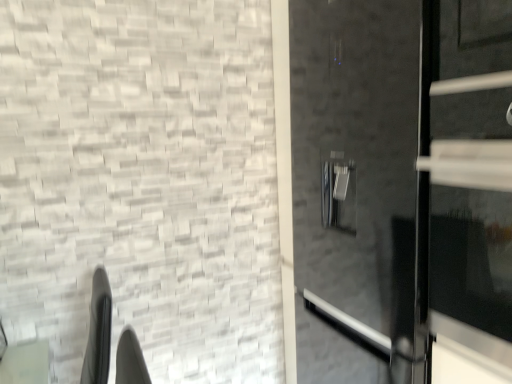
Identify the location of glossy black door at right, which is counted as the second door, starting from the front. (403, 181).

What is the approximate height of glossy black door at right, which is counted as the second door, starting from the front?

It is 5.79 feet.

What do you see at coordinates (403, 181) in the screenshot? I see `glossy black door at right, which is counted as the second door, starting from the front` at bounding box center [403, 181].

Looking at this image, what is the approximate width of glossy black door at right, which is counted as the second door, starting from the front?

glossy black door at right, which is counted as the second door, starting from the front, is 26.76 inches wide.

This screenshot has height=384, width=512. What are the coordinates of `black glass door at right, which is the 1th door from front to back` in the screenshot? It's located at (467, 179).

Describe the element at coordinates (467, 179) in the screenshot. I see `black glass door at right, which is the 1th door from front to back` at that location.

This screenshot has width=512, height=384. Find the location of `glossy black door at right, which is the 1th door from back to front`. glossy black door at right, which is the 1th door from back to front is located at coordinates (403, 181).

Which is more to the left, black glass door at right, which is the 1th door from front to back, or glossy black door at right, which is counted as the second door, starting from the front?

black glass door at right, which is the 1th door from front to back.

Is black glass door at right, which is the 1th door from front to back, further to the viewer compared to glossy black door at right, which is the 1th door from back to front?

No, black glass door at right, which is the 1th door from front to back, is closer to the camera.

Which is behind, point (510, 294) or point (455, 285)?

The point (455, 285) is more distant.

From the image's perspective, between black glass door at right, which is the 1th door from front to back, and glossy black door at right, which is the 1th door from back to front, who is located below?

glossy black door at right, which is the 1th door from back to front, appears lower in the image.

Consider the image. From a real-world perspective, is black glass door at right, which is the 1th door from front to back, positioned above or below glossy black door at right, which is the 1th door from back to front?

Clearly, from a real-world perspective, black glass door at right, which is the 1th door from front to back, is above glossy black door at right, which is the 1th door from back to front.

Does black glass door at right, the 2th door when ordered from back to front, have a greater width compared to glossy black door at right, which is counted as the second door, starting from the front?

No.

In terms of height, does black glass door at right, the 2th door when ordered from back to front, look taller or shorter compared to glossy black door at right, which is counted as the second door, starting from the front?

In the image, black glass door at right, the 2th door when ordered from back to front, appears to be shorter than glossy black door at right, which is counted as the second door, starting from the front.

Considering the sizes of objects black glass door at right, which is the 1th door from front to back, and glossy black door at right, which is the 1th door from back to front, in the image provided, who is bigger, black glass door at right, which is the 1th door from front to back, or glossy black door at right, which is the 1th door from back to front,?

glossy black door at right, which is the 1th door from back to front, is bigger.

Is black glass door at right, the 2th door when ordered from back to front, inside the boundaries of glossy black door at right, which is counted as the second door, starting from the front, or outside?

The correct answer is: inside.

Is black glass door at right, which is the 1th door from front to back, not near glossy black door at right, which is the 1th door from back to front?

That's not correct — black glass door at right, which is the 1th door from front to back, is a little close to glossy black door at right, which is the 1th door from back to front.

Is black glass door at right, the 2th door when ordered from back to front, positioned with its back to glossy black door at right, which is counted as the second door, starting from the front?

Yes, black glass door at right, the 2th door when ordered from back to front, is facing away from glossy black door at right, which is counted as the second door, starting from the front.

From the picture: What's the angular difference between black glass door at right, which is the 1th door from front to back, and glossy black door at right, which is the 1th door from back to front,'s facing directions?

The facing directions of black glass door at right, which is the 1th door from front to back, and glossy black door at right, which is the 1th door from back to front, are 0.973 degrees apart.

Identify the location of door that appears below the black glass door at right, the 2th door when ordered from back to front (from a real-world perspective). This screenshot has width=512, height=384. (403, 181).

Which object is positioned more to the right, glossy black door at right, which is the 1th door from back to front, or black glass door at right, which is the 1th door from front to back?

From the viewer's perspective, glossy black door at right, which is the 1th door from back to front, appears more on the right side.

Is the depth of glossy black door at right, which is the 1th door from back to front, greater than that of black glass door at right, the 2th door when ordered from back to front?

Yes, glossy black door at right, which is the 1th door from back to front, is further from the camera.

Which point is more distant from viewer, (339, 278) or (499, 259)?

The point (339, 278) is farther.

From the image's perspective, which one is positioned higher, glossy black door at right, which is the 1th door from back to front, or black glass door at right, the 2th door when ordered from back to front?

black glass door at right, the 2th door when ordered from back to front.

From a real-world perspective, which object stands above the other?

black glass door at right, the 2th door when ordered from back to front.

Can you confirm if glossy black door at right, which is counted as the second door, starting from the front, is thinner than black glass door at right, the 2th door when ordered from back to front?

Incorrect, the width of glossy black door at right, which is counted as the second door, starting from the front, is not less than that of black glass door at right, the 2th door when ordered from back to front.

In the scene shown: Which of these two, glossy black door at right, which is the 1th door from back to front, or black glass door at right, the 2th door when ordered from back to front, stands shorter?

Standing shorter between the two is black glass door at right, the 2th door when ordered from back to front.

Which of these two, glossy black door at right, which is the 1th door from back to front, or black glass door at right, the 2th door when ordered from back to front, is smaller?

black glass door at right, the 2th door when ordered from back to front, is smaller.

Is glossy black door at right, which is the 1th door from back to front, outside of black glass door at right, which is the 1th door from front to back?

Yes, glossy black door at right, which is the 1th door from back to front, is outside of black glass door at right, which is the 1th door from front to back.

Is glossy black door at right, which is counted as the second door, starting from the front, beside black glass door at right, which is the 1th door from front to back?

Yes, glossy black door at right, which is counted as the second door, starting from the front, is beside black glass door at right, which is the 1th door from front to back.

Does glossy black door at right, which is the 1th door from back to front, turn towards black glass door at right, the 2th door when ordered from back to front?

Yes, glossy black door at right, which is the 1th door from back to front, is turned towards black glass door at right, the 2th door when ordered from back to front.

Can you tell me how much glossy black door at right, which is the 1th door from back to front, and black glass door at right, the 2th door when ordered from back to front, differ in facing direction?

glossy black door at right, which is the 1th door from back to front, and black glass door at right, the 2th door when ordered from back to front, are facing 0.973 degrees away from each other.

Measure the distance from glossy black door at right, which is counted as the second door, starting from the front, to black glass door at right, which is the 1th door from front to back.

2.93 inches.

Where is `door below the black glass door at right, the 2th door when ordered from back to front (from a real-world perspective)`? The width and height of the screenshot is (512, 384). door below the black glass door at right, the 2th door when ordered from back to front (from a real-world perspective) is located at coordinates (403, 181).

Image resolution: width=512 pixels, height=384 pixels. I want to click on door in front of the glossy black door at right, which is counted as the second door, starting from the front, so click(467, 179).

Find the location of `door on the left of glossy black door at right, which is the 1th door from back to front`. door on the left of glossy black door at right, which is the 1th door from back to front is located at coordinates (467, 179).